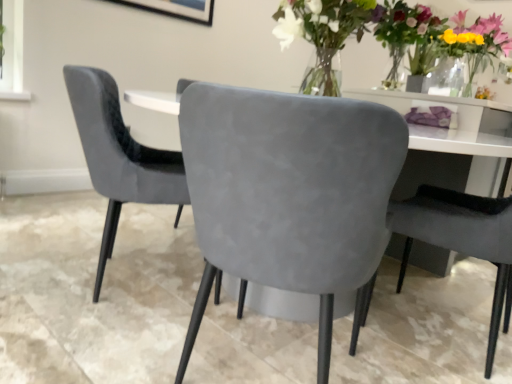
Question: From the image's perspective, does suede gray chair at center, marked as the third chair in a left-to-right arrangement, appear higher than velvet grey chair at center, which is the third chair from right to left?

Choices:
 (A) no
 (B) yes

Answer: (A)

Question: Considering the relative sizes of suede gray chair at center, marked as the third chair in a left-to-right arrangement, and velvet grey chair at center, placed as the first chair when sorted from left to right, in the image provided, is suede gray chair at center, marked as the third chair in a left-to-right arrangement, smaller than velvet grey chair at center, placed as the first chair when sorted from left to right,?

Choices:
 (A) no
 (B) yes

Answer: (B)

Question: Are suede gray chair at center, which ranks as the first chair in right-to-left order, and velvet grey chair at center, placed as the first chair when sorted from left to right, far apart?

Choices:
 (A) yes
 (B) no

Answer: (B)

Question: Is velvet grey chair at center, placed as the first chair when sorted from left to right, located within suede gray chair at center, which ranks as the first chair in right-to-left order?

Choices:
 (A) yes
 (B) no

Answer: (B)

Question: Is suede gray chair at center, which ranks as the first chair in right-to-left order, closer to the viewer compared to velvet grey chair at center, which is the third chair from right to left?

Choices:
 (A) no
 (B) yes

Answer: (B)

Question: Is suede gray chair at center, which ranks as the first chair in right-to-left order, positioned with its back to velvet grey chair at center, placed as the first chair when sorted from left to right?

Choices:
 (A) yes
 (B) no

Answer: (B)

Question: Is suede gray chair at center, which ranks as the first chair in right-to-left order, outside of matte glass vase at upper right?

Choices:
 (A) yes
 (B) no

Answer: (A)

Question: Is the depth of suede gray chair at center, marked as the third chair in a left-to-right arrangement, greater than that of matte glass vase at upper right?

Choices:
 (A) yes
 (B) no

Answer: (B)

Question: Is matte glass vase at upper right inside suede gray chair at center, which ranks as the first chair in right-to-left order?

Choices:
 (A) no
 (B) yes

Answer: (A)

Question: Can you confirm if suede gray chair at center, which ranks as the first chair in right-to-left order, is wider than matte glass vase at upper right?

Choices:
 (A) no
 (B) yes

Answer: (B)

Question: From a real-world perspective, is suede gray chair at center, which ranks as the first chair in right-to-left order, located higher than matte glass vase at upper right?

Choices:
 (A) yes
 (B) no

Answer: (B)

Question: Does suede gray chair at center, which ranks as the first chair in right-to-left order, have a greater height compared to matte glass vase at upper right?

Choices:
 (A) no
 (B) yes

Answer: (B)

Question: Are matte glass vase at upper right and suede gray chair at center, marked as the third chair in a left-to-right arrangement, located far from each other?

Choices:
 (A) yes
 (B) no

Answer: (A)